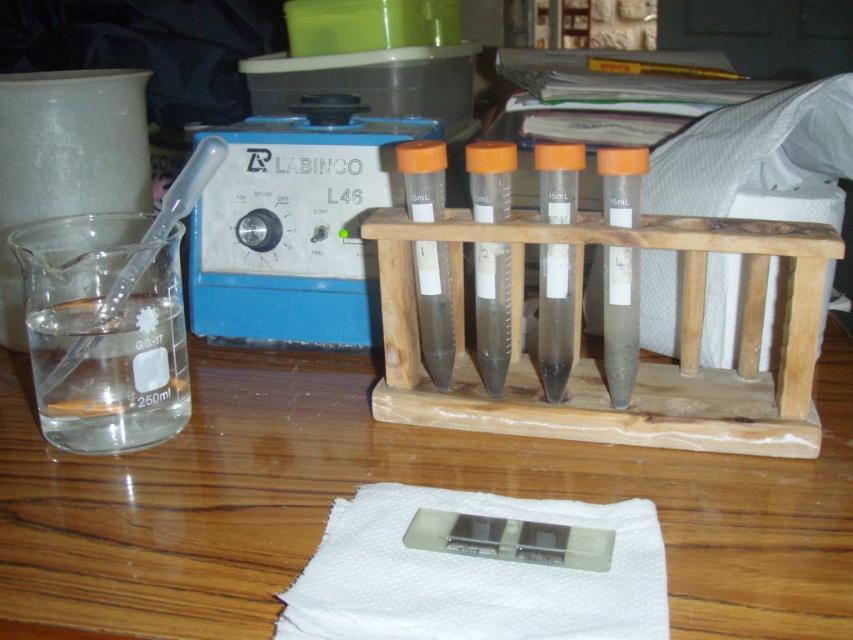
Which of these two, wooden table at center or transparent glass beaker at left, stands taller?

wooden table at center

Between wooden table at center and transparent glass beaker at left, which one appears on the left side from the viewer's perspective?

transparent glass beaker at left is more to the left.

The height and width of the screenshot is (640, 853). What do you see at coordinates (387, 481) in the screenshot?
I see `wooden table at center` at bounding box center [387, 481].

What are the coordinates of `wooden table at center` in the screenshot? It's located at (387, 481).

Is wooden table at center thinner than transparent wood test tube rack at center?

No, wooden table at center is not thinner than transparent wood test tube rack at center.

Is wooden table at center to the left of transparent wood test tube rack at center from the viewer's perspective?

Yes, wooden table at center is to the left of transparent wood test tube rack at center.

You are a GUI agent. You are given a task and a screenshot of the screen. Output one action in this format:
    pyautogui.click(x=<x>, y=<y>)
    Task: Click on the wooden table at center
    The width and height of the screenshot is (853, 640).
    Given the screenshot: What is the action you would take?
    pyautogui.click(x=387, y=481)

Is transparent wood test tube rack at center to the left of transparent glass beaker at left from the viewer's perspective?

No, transparent wood test tube rack at center is not to the left of transparent glass beaker at left.

Does transparent wood test tube rack at center appear over transparent glass beaker at left?

Correct, transparent wood test tube rack at center is located above transparent glass beaker at left.

The height and width of the screenshot is (640, 853). I want to click on transparent wood test tube rack at center, so click(596, 358).